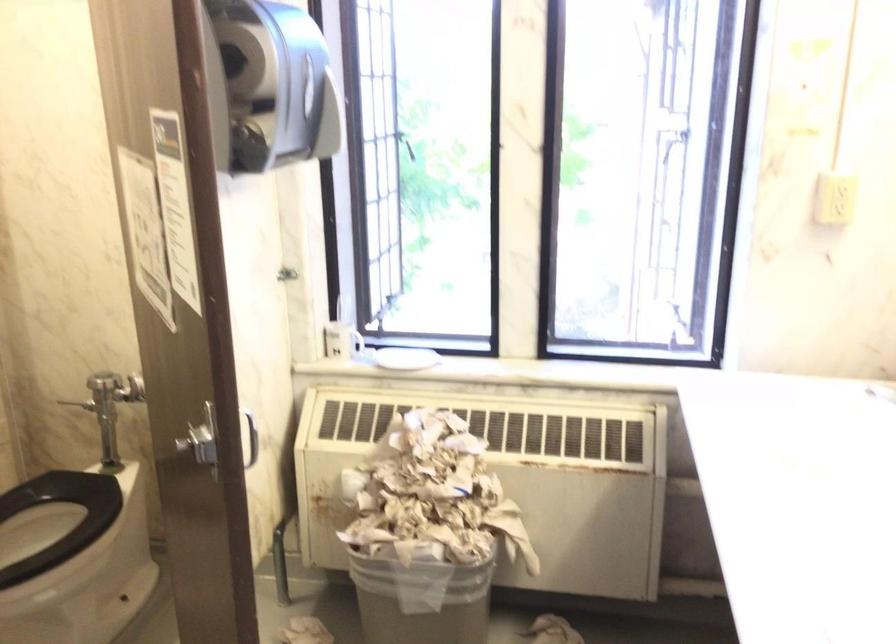
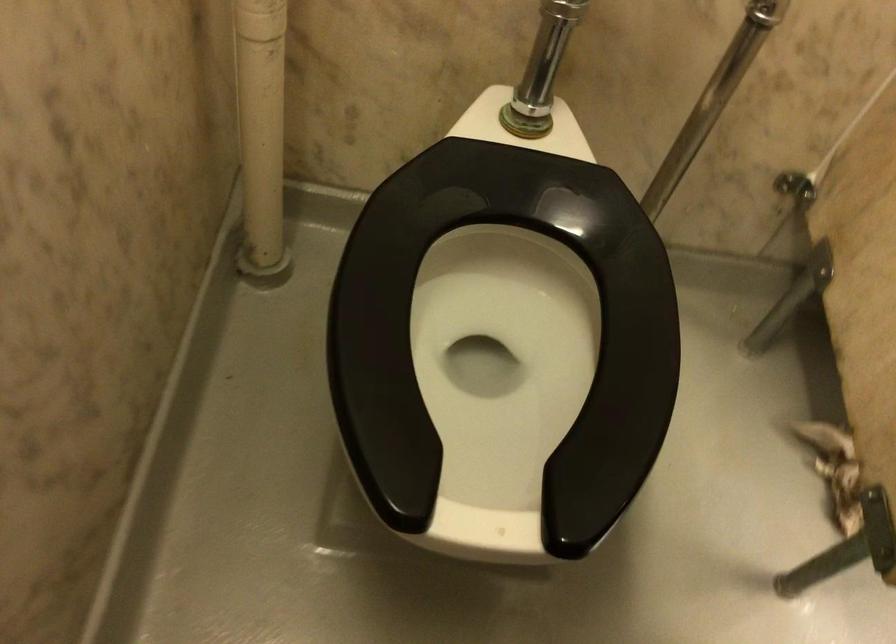
Locate, in the second image, the point that corresponds to (74,562) in the first image.

(504, 332)